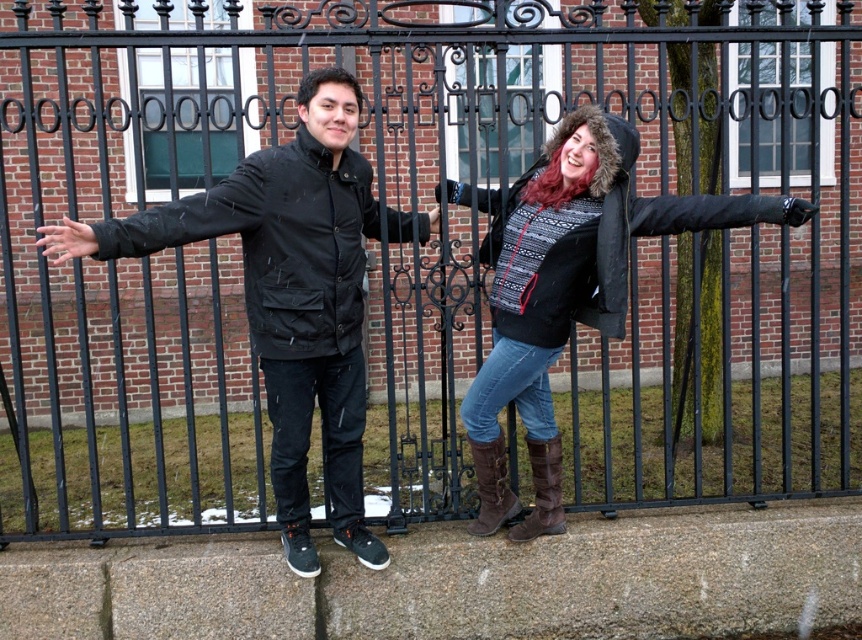
Question: Based on their relative distances, which object is nearer to the brown leather boot at lower center?

Choices:
 (A) knit sweater at center
 (B) brown leather boot at center

Answer: (B)

Question: Does matte black jacket at left appear under black matte jacket at left?

Choices:
 (A) yes
 (B) no

Answer: (A)

Question: Is brown leather boot at lower center bigger than brown leather boot at center?

Choices:
 (A) no
 (B) yes

Answer: (A)

Question: Which point is farther to the camera?

Choices:
 (A) (501, 520)
 (B) (542, 476)

Answer: (A)

Question: Is matte black jacket at left wider than knit sweater at center?

Choices:
 (A) yes
 (B) no

Answer: (B)

Question: Which is nearer to the brown leather boot at center?

Choices:
 (A) brown leather boot at lower center
 (B) black matte jacket at left
 (C) knit sweater at center
 (D) matte black jacket at left

Answer: (A)